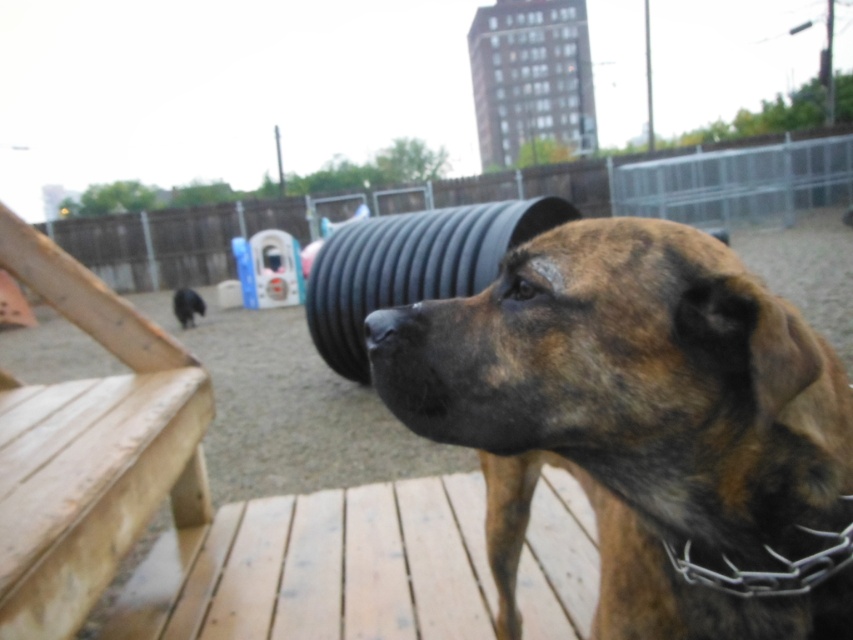
Does brindle fur dog at center have a lesser width compared to black rubber tire at center?

Yes.

What do you see at coordinates (643, 420) in the screenshot? The width and height of the screenshot is (853, 640). I see `brindle fur dog at center` at bounding box center [643, 420].

You are a GUI agent. You are given a task and a screenshot of the screen. Output one action in this format:
    pyautogui.click(x=<x>, y=<y>)
    Task: Click on the brindle fur dog at center
    Image resolution: width=853 pixels, height=640 pixels.
    Given the screenshot: What is the action you would take?
    pyautogui.click(x=643, y=420)

Is brindle fur dog at center to the left of black rubber nose at center from the viewer's perspective?

In fact, brindle fur dog at center is to the right of black rubber nose at center.

Is point (834, 621) positioned behind point (403, 316)?

No.

The width and height of the screenshot is (853, 640). Find the location of `brindle fur dog at center`. brindle fur dog at center is located at coordinates (643, 420).

Does point (432, 237) come closer to viewer compared to point (370, 330)?

No, it is behind (370, 330).

Who is more distant from viewer, (360, 310) or (366, 324)?

The point (360, 310) is more distant.

Where is `black rubber tire at center`? The height and width of the screenshot is (640, 853). black rubber tire at center is located at coordinates (410, 266).

At what (x,y) coordinates should I click in order to perform the action: click on black rubber tire at center. Please return your answer as a coordinate pair (x, y). The height and width of the screenshot is (640, 853). Looking at the image, I should click on (410, 266).